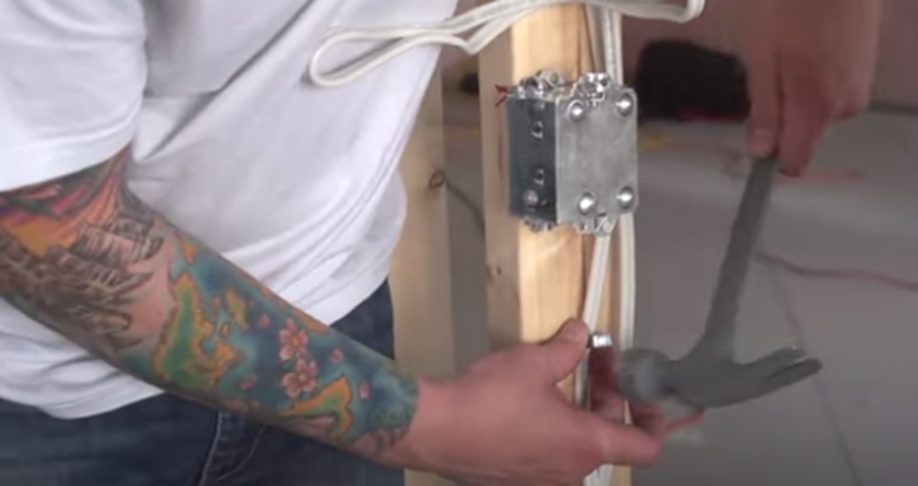
What are the coordinates of `electric box` in the screenshot? It's located at [596, 178].